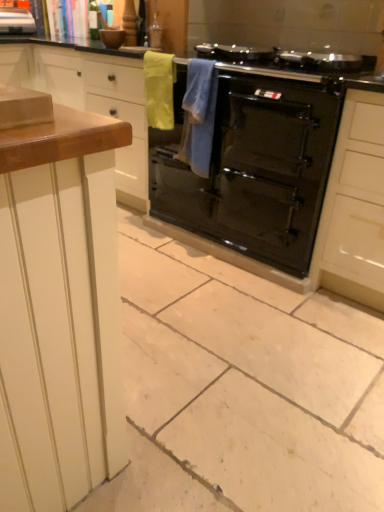
Where is `yellow fabric towel at upper center, the second material positioned from the right`? Image resolution: width=384 pixels, height=512 pixels. yellow fabric towel at upper center, the second material positioned from the right is located at coordinates (159, 89).

The image size is (384, 512). I want to click on wooden countertop at left, so click(x=90, y=99).

Which is closer to the camera, (x=7, y=64) or (x=172, y=128)?

Point (x=7, y=64) is positioned farther from the camera compared to point (x=172, y=128).

Measure the distance between wooden countertop at left and yellow fabric towel at upper center, the second material positioned from the right.

wooden countertop at left is 18.11 inches away from yellow fabric towel at upper center, the second material positioned from the right.

Does wooden countertop at left turn towards yellow fabric towel at upper center, the second material positioned from the right?

No, wooden countertop at left does not turn towards yellow fabric towel at upper center, the second material positioned from the right.

Can you confirm if wooden countertop at left is positioned to the left of metallic silver toaster at upper left?

No, wooden countertop at left is not to the left of metallic silver toaster at upper left.

From a real-world perspective, is wooden countertop at left positioned above or below metallic silver toaster at upper left?

Clearly, from a real-world perspective, wooden countertop at left is below metallic silver toaster at upper left.

How different are the orientations of wooden countertop at left and metallic silver toaster at upper left in degrees?

89.8 degrees.

Is metallic silver toaster at upper left positioned in front of blue towel at center, which ranks as the second material in left-to-right order?

That is False.

In the image, is metallic silver toaster at upper left on the left side or the right side of blue towel at center, arranged as the 1th material when viewed from the right?

In the image, metallic silver toaster at upper left appears on the left side of blue towel at center, arranged as the 1th material when viewed from the right.

The width and height of the screenshot is (384, 512). I want to click on appliance that is above the blue towel at center, which ranks as the second material in left-to-right order (from a real-world perspective), so click(x=16, y=21).

Considering the relative sizes of black glossy oven at center and metallic silver toaster at upper left in the image provided, is black glossy oven at center shorter than metallic silver toaster at upper left?

In fact, black glossy oven at center may be taller than metallic silver toaster at upper left.

What's the angular difference between black glossy oven at center and metallic silver toaster at upper left's facing directions?

89.8 degrees.

From the image's perspective, is black glossy oven at center on top of metallic silver toaster at upper left?

No, from the image's perspective, black glossy oven at center is not above metallic silver toaster at upper left.

Is black glossy oven at center with metallic silver toaster at upper left?

No.

Is point (94, 87) more distant than point (200, 131)?

Yes, it is.

Considering the relative positions of wooden countertop at left and blue towel at center, arranged as the 1th material when viewed from the right, in the image provided, is wooden countertop at left to the right of blue towel at center, arranged as the 1th material when viewed from the right, from the viewer's perspective?

No.

Which of these two, wooden countertop at left or blue towel at center, which ranks as the second material in left-to-right order, stands shorter?

blue towel at center, which ranks as the second material in left-to-right order, is shorter.

In the image, there is a blue towel at center, which ranks as the second material in left-to-right order. Where is `cabinetry above it (from the image's perspective)`? The image size is (384, 512). cabinetry above it (from the image's perspective) is located at coordinates (90, 99).

From a real-world perspective, which object stands above the other?

metallic silver toaster at upper left is physically above.

Does metallic silver toaster at upper left have a larger size compared to wooden countertop at left?

No, metallic silver toaster at upper left is not bigger than wooden countertop at left.

Is wooden countertop at left surrounded by metallic silver toaster at upper left?

No, wooden countertop at left is not surrounded by metallic silver toaster at upper left.

Is metallic silver toaster at upper left not near wooden countertop at left?

No, there isn't a large distance between metallic silver toaster at upper left and wooden countertop at left.

Between black glossy oven at center and wooden countertop at left, which one has larger width?

With larger width is black glossy oven at center.

From the image's perspective, would you say black glossy oven at center is positioned over wooden countertop at left?

Incorrect, from the image's perspective, black glossy oven at center is lower than wooden countertop at left.

Can you confirm if black glossy oven at center is taller than wooden countertop at left?

Incorrect, the height of black glossy oven at center is not larger of that of wooden countertop at left.

Does point (214, 220) come farther from viewer compared to point (42, 85)?

No, it is not.

At what (x,y) coordinates should I click in order to perform the action: click on cabinetry that appears on the left of yellow fabric towel at upper center, the second material positioned from the right. Please return your answer as a coordinate pair (x, y). This screenshot has height=512, width=384. Looking at the image, I should click on (90, 99).

I want to click on cabinetry located below the metallic silver toaster at upper left (from the image's perspective), so click(x=90, y=99).

Looking at the image, which one is located further to blue towel at center, arranged as the 1th material when viewed from the right, wooden countertop at left or metallic silver toaster at upper left?

metallic silver toaster at upper left.

Considering their positions, is black glossy oven at center positioned further to metallic silver toaster at upper left than blue towel at center, which ranks as the second material in left-to-right order?

The object further to metallic silver toaster at upper left is black glossy oven at center.

Based on their spatial positions, is yellow fabric towel at upper center, the second material positioned from the right, or black glossy oven at center closer to metallic silver toaster at upper left?

yellow fabric towel at upper center, the second material positioned from the right, is positioned closer to the anchor metallic silver toaster at upper left.

Based on their spatial positions, is blue towel at center, which ranks as the second material in left-to-right order, or yellow fabric towel at upper center, the first material positioned from the left, closer to black glossy oven at center?

Based on the image, blue towel at center, which ranks as the second material in left-to-right order, appears to be nearer to black glossy oven at center.

Looking at the image, which one is located closer to black glossy oven at center, blue towel at center, which ranks as the second material in left-to-right order, or wooden countertop at left?

Among the two, blue towel at center, which ranks as the second material in left-to-right order, is located nearer to black glossy oven at center.

Based on their spatial positions, is metallic silver toaster at upper left or black glossy oven at center closer to blue towel at center, arranged as the 1th material when viewed from the right?

black glossy oven at center is closer to blue towel at center, arranged as the 1th material when viewed from the right.

Considering their positions, is yellow fabric towel at upper center, the first material positioned from the left, positioned further to metallic silver toaster at upper left than wooden countertop at left?

yellow fabric towel at upper center, the first material positioned from the left, lies further to metallic silver toaster at upper left than the other object.

Estimate the real-world distances between objects in this image. Which object is further from blue towel at center, which ranks as the second material in left-to-right order, metallic silver toaster at upper left or yellow fabric towel at upper center, the second material positioned from the right?

metallic silver toaster at upper left.

Where is `cabinetry situated between metallic silver toaster at upper left and black glossy oven at center from left to right`? The width and height of the screenshot is (384, 512). cabinetry situated between metallic silver toaster at upper left and black glossy oven at center from left to right is located at coordinates (90, 99).

Identify the location of material situated between wooden countertop at left and blue towel at center, arranged as the 1th material when viewed from the right, from left to right. (159, 89).

Find the location of a particular element. The image size is (384, 512). material between yellow fabric towel at upper center, the first material positioned from the left, and black glossy oven at center, in the horizontal direction is located at coordinates (199, 116).

Locate an element on the screen. This screenshot has height=512, width=384. cabinetry between metallic silver toaster at upper left and yellow fabric towel at upper center, the second material positioned from the right, in the horizontal direction is located at coordinates (90, 99).